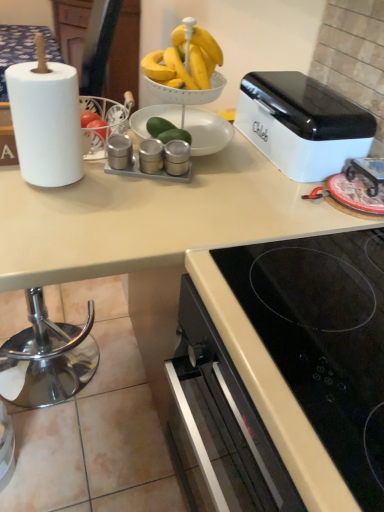
Where is `satin silver salt and pepper shakers at center, the 2th appliance in the right-to-left sequence`? satin silver salt and pepper shakers at center, the 2th appliance in the right-to-left sequence is located at coordinates (151, 156).

This screenshot has height=512, width=384. Describe the element at coordinates (324, 340) in the screenshot. I see `black glass cooktop at lower right` at that location.

What do you see at coordinates (119, 151) in the screenshot?
I see `metallic silver spice containers at center, acting as the third appliance starting from the right` at bounding box center [119, 151].

You are a GUI agent. You are given a task and a screenshot of the screen. Output one action in this format:
    pyautogui.click(x=<x>, y=<y>)
    Task: Click on the metallic silver spice containers at center, marked as the 1th appliance in a left-to-right arrangement
    The image size is (384, 512).
    Given the screenshot: What is the action you would take?
    pyautogui.click(x=119, y=151)

Where is `satin silver salt and pepper shakers at center, which appears as the first appliance when viewed from the right`? satin silver salt and pepper shakers at center, which appears as the first appliance when viewed from the right is located at coordinates (176, 157).

Identify the location of satin silver salt and pepper shakers at center, the 2th appliance in the right-to-left sequence. (151, 156).

From the image's perspective, is black glass cooktop at lower right over white glossy toaster at upper right?

Incorrect, from the image's perspective, black glass cooktop at lower right is lower than white glossy toaster at upper right.

How far apart are black glass cooktop at lower right and white glossy toaster at upper right?

black glass cooktop at lower right is 18.23 inches away from white glossy toaster at upper right.

Considering the positions of point (335, 338) and point (335, 92), is point (335, 338) closer or farther from the camera than point (335, 92)?

Point (335, 338) appears to be closer to the viewer than point (335, 92).

Can you confirm if black glass cooktop at lower right is thinner than white glossy toaster at upper right?

No, black glass cooktop at lower right is not thinner than white glossy toaster at upper right.

From the picture: From the image's perspective, relative to white matte paper towel at left, is black glass cooktop at lower right above or below?

From the image's perspective, black glass cooktop at lower right appears below white matte paper towel at left.

Can you confirm if black glass cooktop at lower right is taller than white matte paper towel at left?

No.

Is black glass cooktop at lower right wider or thinner than white matte paper towel at left?

black glass cooktop at lower right is wider than white matte paper towel at left.

How far apart are black glass cooktop at lower right and white matte paper towel at left?

black glass cooktop at lower right and white matte paper towel at left are 22.29 inches apart.

How many degrees apart are the facing directions of metallic silver spice containers at center, marked as the 1th appliance in a left-to-right arrangement, and white glossy toaster at upper right?

65.2 degrees separate the facing orientations of metallic silver spice containers at center, marked as the 1th appliance in a left-to-right arrangement, and white glossy toaster at upper right.

Is metallic silver spice containers at center, marked as the 1th appliance in a left-to-right arrangement, closer to the viewer compared to white glossy toaster at upper right?

No, metallic silver spice containers at center, marked as the 1th appliance in a left-to-right arrangement, is further to the viewer.

Is metallic silver spice containers at center, acting as the third appliance starting from the right, thinner than white glossy toaster at upper right?

Yes, metallic silver spice containers at center, acting as the third appliance starting from the right, is thinner than white glossy toaster at upper right.

Based on their positions, is metallic silver spice containers at center, marked as the 1th appliance in a left-to-right arrangement, located to the left or right of white glossy toaster at upper right?

metallic silver spice containers at center, marked as the 1th appliance in a left-to-right arrangement, is positioned on white glossy toaster at upper right's left side.

Which object is closer to the camera taking this photo, white glossy toaster at upper right or white matte paper towel at left?

white matte paper towel at left is more forward.

Considering the relative sizes of white glossy toaster at upper right and white matte paper towel at left in the image provided, is white glossy toaster at upper right taller than white matte paper towel at left?

In fact, white glossy toaster at upper right may be shorter than white matte paper towel at left.

Where is `the 2nd appliance to the right of the white matte paper towel at left, starting your count from the anchor`? the 2nd appliance to the right of the white matte paper towel at left, starting your count from the anchor is located at coordinates [151, 156].

Which object is positioned more to the right, white matte paper towel at left or satin silver salt and pepper shakers at center, the 2th appliance in the right-to-left sequence?

From the viewer's perspective, satin silver salt and pepper shakers at center, the 2th appliance in the right-to-left sequence, appears more on the right side.

From the image's perspective, which object appears higher, white matte paper towel at left or satin silver salt and pepper shakers at center, which ranks as the second appliance in left-to-right order?

white matte paper towel at left.

Considering their positions, is white matte paper towel at left located in front of or behind satin silver salt and pepper shakers at center, the 2th appliance in the right-to-left sequence?

Clearly, white matte paper towel at left is in front of satin silver salt and pepper shakers at center, the 2th appliance in the right-to-left sequence.

Consider the image. Between satin silver salt and pepper shakers at center, which ranks as the second appliance in left-to-right order, and black glass cooktop at lower right, which one has smaller width?

Thinner between the two is satin silver salt and pepper shakers at center, which ranks as the second appliance in left-to-right order.

Between satin silver salt and pepper shakers at center, which ranks as the second appliance in left-to-right order, and black glass cooktop at lower right, which one appears on the left side from the viewer's perspective?

Positioned to the left is satin silver salt and pepper shakers at center, which ranks as the second appliance in left-to-right order.

Between satin silver salt and pepper shakers at center, the 2th appliance in the right-to-left sequence, and black glass cooktop at lower right, which one has larger size?

Bigger between the two is black glass cooktop at lower right.

This screenshot has width=384, height=512. Identify the location of the 2nd appliance behind the black glass cooktop at lower right. (151, 156).

In the image, is metallic silver spice containers at center, marked as the 1th appliance in a left-to-right arrangement, positioned in front of or behind white matte paper towel at left?

metallic silver spice containers at center, marked as the 1th appliance in a left-to-right arrangement, is behind white matte paper towel at left.

In the scene shown: Are metallic silver spice containers at center, acting as the third appliance starting from the right, and white matte paper towel at left making contact?

No, metallic silver spice containers at center, acting as the third appliance starting from the right, is not making contact with white matte paper towel at left.

Considering the sizes of objects metallic silver spice containers at center, marked as the 1th appliance in a left-to-right arrangement, and white matte paper towel at left in the image provided, who is bigger, metallic silver spice containers at center, marked as the 1th appliance in a left-to-right arrangement, or white matte paper towel at left?

white matte paper towel at left.

Locate an element on the screen. This screenshot has height=512, width=384. toaster above the black glass cooktop at lower right (from a real-world perspective) is located at coordinates (302, 124).

Image resolution: width=384 pixels, height=512 pixels. Find the location of `paper towel that is behind the black glass cooktop at lower right`. paper towel that is behind the black glass cooktop at lower right is located at coordinates (46, 123).

Estimate the real-world distances between objects in this image. Which object is closer to metallic silver spice containers at center, acting as the third appliance starting from the right, satin silver salt and pepper shakers at center, the 2th appliance in the right-to-left sequence, or black glass cooktop at lower right?

satin silver salt and pepper shakers at center, the 2th appliance in the right-to-left sequence, lies closer to metallic silver spice containers at center, acting as the third appliance starting from the right, than the other object.

Consider the image. Which object lies further to the anchor point white matte paper towel at left, white glossy toaster at upper right or satin silver salt and pepper shakers at center, which appears as the first appliance when viewed from the right?

Based on the image, white glossy toaster at upper right appears to be further to white matte paper towel at left.

Which object lies nearer to the anchor point white glossy toaster at upper right, black glass cooktop at lower right or metallic silver spice containers at center, marked as the 1th appliance in a left-to-right arrangement?

black glass cooktop at lower right.

From the image, which object appears to be nearer to white matte paper towel at left, metallic silver spice containers at center, marked as the 1th appliance in a left-to-right arrangement, or satin silver salt and pepper shakers at center, which ranks as the second appliance in left-to-right order?

metallic silver spice containers at center, marked as the 1th appliance in a left-to-right arrangement, lies closer to white matte paper towel at left than the other object.

Based on their spatial positions, is metallic silver spice containers at center, acting as the third appliance starting from the right, or satin silver salt and pepper shakers at center, which appears as the first appliance when viewed from the right, closer to white matte paper towel at left?

metallic silver spice containers at center, acting as the third appliance starting from the right, lies closer to white matte paper towel at left than the other object.

Considering their positions, is satin silver salt and pepper shakers at center, the 2th appliance in the right-to-left sequence, positioned closer to white glossy toaster at upper right than white matte paper towel at left?

satin silver salt and pepper shakers at center, the 2th appliance in the right-to-left sequence, is positioned closer to the anchor white glossy toaster at upper right.

Looking at the image, which one is located further to metallic silver spice containers at center, marked as the 1th appliance in a left-to-right arrangement, satin silver salt and pepper shakers at center, marked as the third appliance in a left-to-right arrangement, or satin silver salt and pepper shakers at center, which ranks as the second appliance in left-to-right order?

Among the two, satin silver salt and pepper shakers at center, marked as the third appliance in a left-to-right arrangement, is located further to metallic silver spice containers at center, marked as the 1th appliance in a left-to-right arrangement.

Considering their positions, is black glass cooktop at lower right positioned further to metallic silver spice containers at center, acting as the third appliance starting from the right, than satin silver salt and pepper shakers at center, marked as the third appliance in a left-to-right arrangement?

black glass cooktop at lower right.

At what (x,y) coordinates should I click in order to perform the action: click on gas stove situated between white matte paper towel at left and white glossy toaster at upper right from left to right. Please return your answer as a coordinate pair (x, y). The width and height of the screenshot is (384, 512). Looking at the image, I should click on (324, 340).

You are a GUI agent. You are given a task and a screenshot of the screen. Output one action in this format:
    pyautogui.click(x=<x>, y=<y>)
    Task: Click on the toaster between black glass cooktop at lower right and metallic silver spice containers at center, marked as the 1th appliance in a left-to-right arrangement, in the front-back direction
    
    Given the screenshot: What is the action you would take?
    point(302,124)

I want to click on appliance located between black glass cooktop at lower right and white glossy toaster at upper right in the depth direction, so click(x=176, y=157).

Find the location of a particular element. Image resolution: width=384 pixels, height=512 pixels. appliance located between metallic silver spice containers at center, marked as the 1th appliance in a left-to-right arrangement, and satin silver salt and pepper shakers at center, marked as the third appliance in a left-to-right arrangement, in the left-right direction is located at coordinates (151, 156).